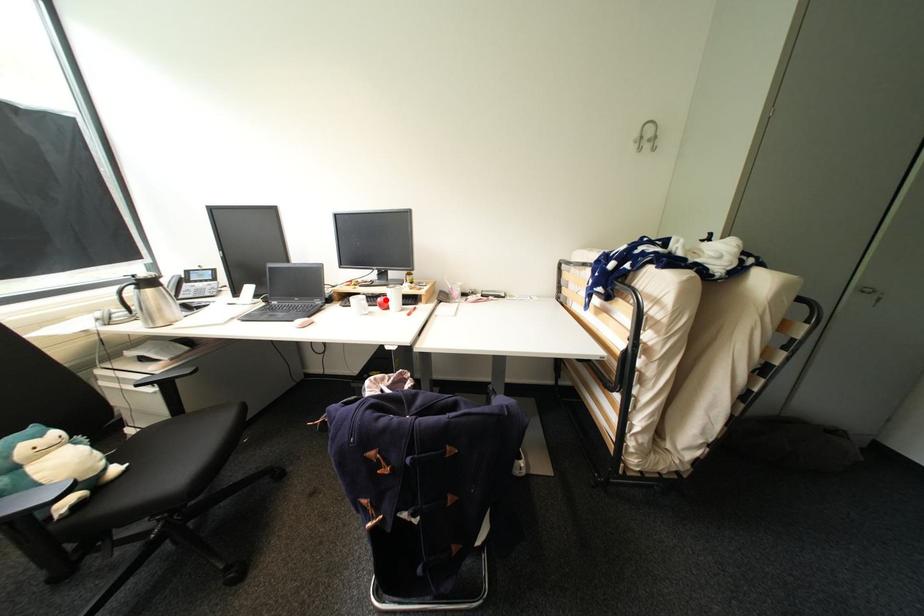
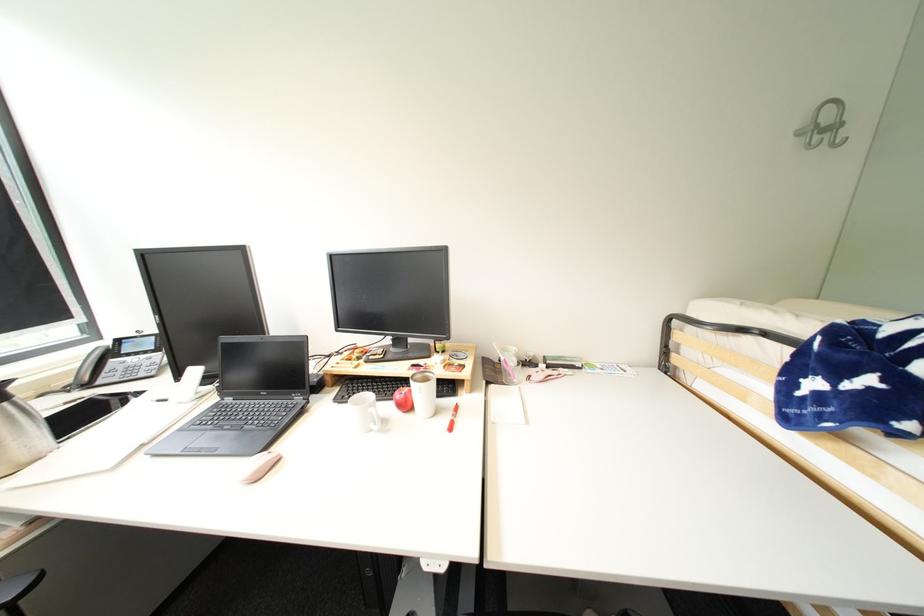
Locate, in the second image, the point that corresponds to the highlighted location in the first image.

(405, 397)